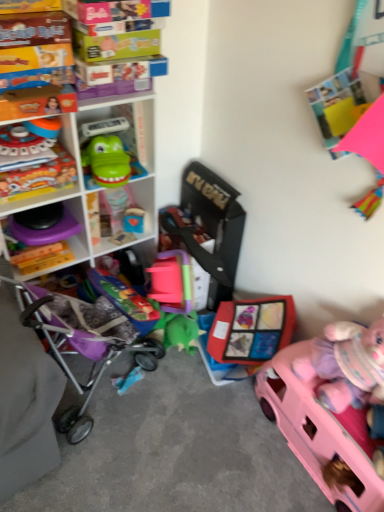
Image resolution: width=384 pixels, height=512 pixels. I want to click on free space above pink plastic car at lower right, acting as the first toy starting from the right (from a real-world perspective), so click(336, 414).